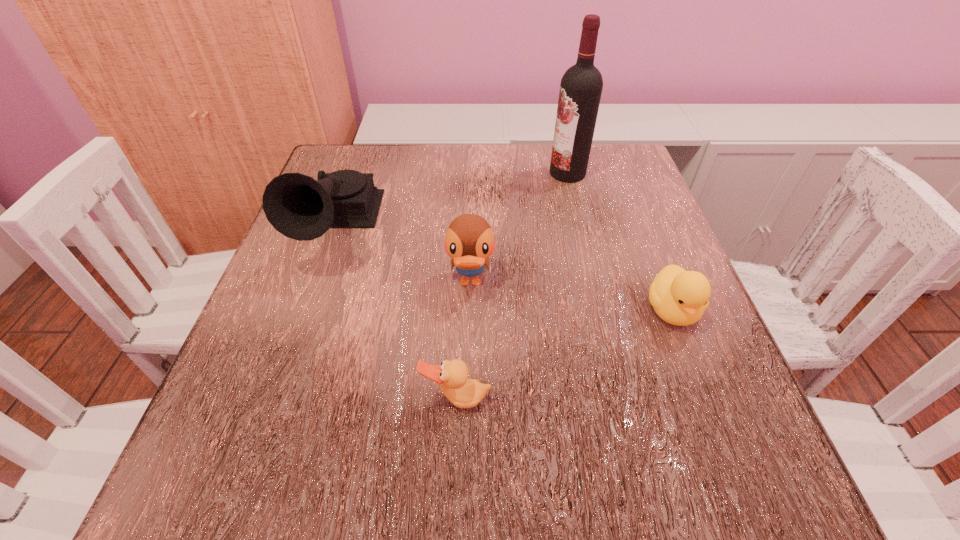
Image resolution: width=960 pixels, height=540 pixels. In order to click on the tallest object in this screenshot , I will do `click(581, 86)`.

At what (x,y) coordinates should I click in order to perform the action: click on the second object from right to left. Please return your answer as a coordinate pair (x, y). The width and height of the screenshot is (960, 540). Looking at the image, I should click on (581, 86).

Where is `the leftmost object`? the leftmost object is located at coordinates tap(299, 207).

Find the location of a particular element. The width and height of the screenshot is (960, 540). the fourth shortest object is located at coordinates (299, 207).

At what (x,y) coordinates should I click in order to perform the action: click on the tallest duck. Please return your answer as a coordinate pair (x, y). Image resolution: width=960 pixels, height=540 pixels. Looking at the image, I should click on (469, 241).

At what (x,y) coordinates should I click in order to perform the action: click on the second tallest duck. Please return your answer as a coordinate pair (x, y). Looking at the image, I should click on (679, 297).

This screenshot has width=960, height=540. I want to click on the rightmost object, so click(x=679, y=297).

You are a GUI agent. You are given a task and a screenshot of the screen. Output one action in this format:
    pyautogui.click(x=<x>, y=<y>)
    Task: Click on the nearest duck
    This screenshot has height=540, width=960.
    Given the screenshot: What is the action you would take?
    pyautogui.click(x=452, y=376)

At what (x,y) coordinates should I click in order to perform the action: click on the nearest object. Please return your answer as a coordinate pair (x, y). Image resolution: width=960 pixels, height=540 pixels. Looking at the image, I should click on (452, 376).

Find the location of a particular element. The image size is (960, 540). vacant region located on the label of the wine bottle is located at coordinates (498, 173).